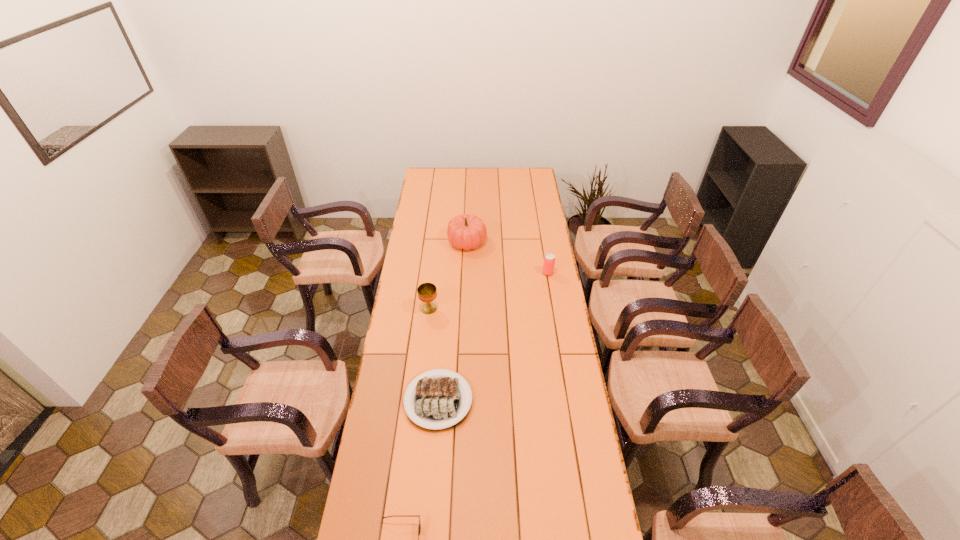
You are a GUI agent. You are given a task and a screenshot of the screen. Output one action in this format:
    pyautogui.click(x=<x>, y=<y>)
    Task: Click on the plate that is at the left edge
    The image size is (960, 540).
    Given the screenshot: What is the action you would take?
    pyautogui.click(x=437, y=401)

This screenshot has width=960, height=540. Identify the location of object that is at the right edge. (549, 260).

In order to click on vacant point at the far edge in this screenshot , I will do `click(510, 178)`.

In the image, there is a desktop. Where is `vacant space at the left edge`? Image resolution: width=960 pixels, height=540 pixels. vacant space at the left edge is located at coordinates (426, 266).

What are the coordinates of `vacant space at the right edge of the desktop` in the screenshot? It's located at (596, 505).

The width and height of the screenshot is (960, 540). I want to click on vacant area at the far left corner, so pos(440,179).

Where is `free space between the farthest object and the chalice`? free space between the farthest object and the chalice is located at coordinates pyautogui.click(x=448, y=275).

What are the coordinates of `free spot between the chalice and the second nearest object` in the screenshot? It's located at (434, 354).

In order to click on vacant area that lies between the third nearest object and the farthest object in this screenshot , I will do `click(448, 275)`.

The width and height of the screenshot is (960, 540). Find the location of `vacant region between the chalice and the third tallest object`. vacant region between the chalice and the third tallest object is located at coordinates (489, 291).